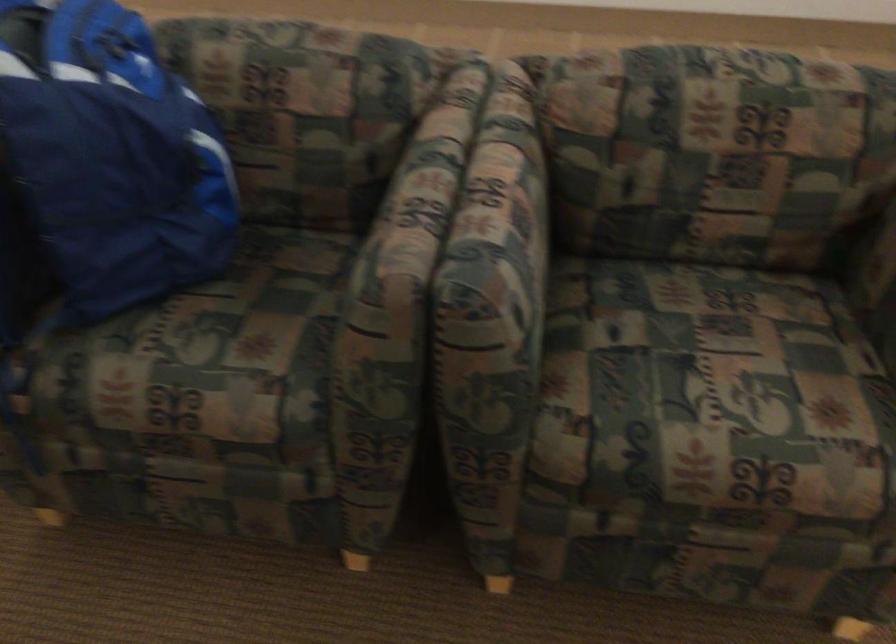
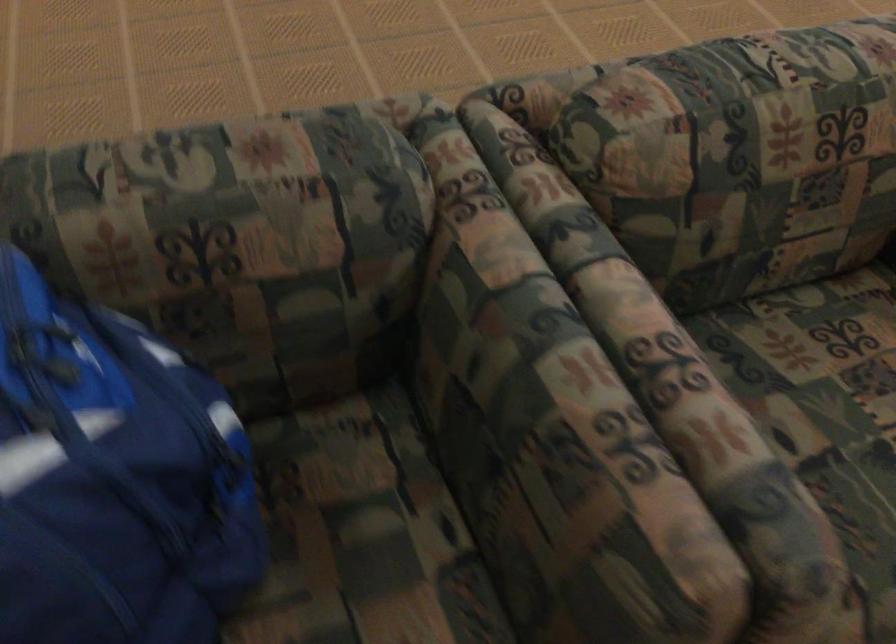
In a continuous first-person perspective shot, in which direction is the camera moving?

The movement direction of the cameraman is left, forward.